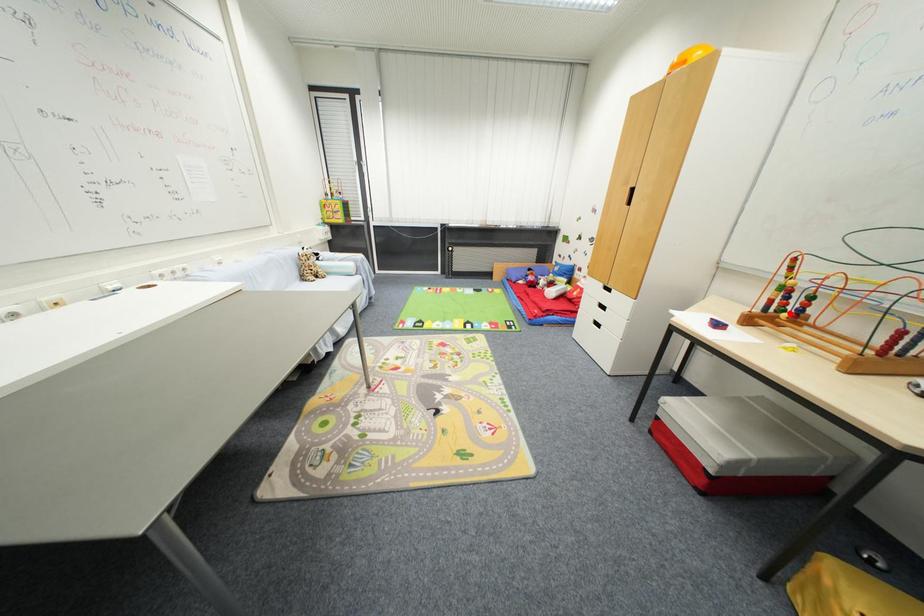
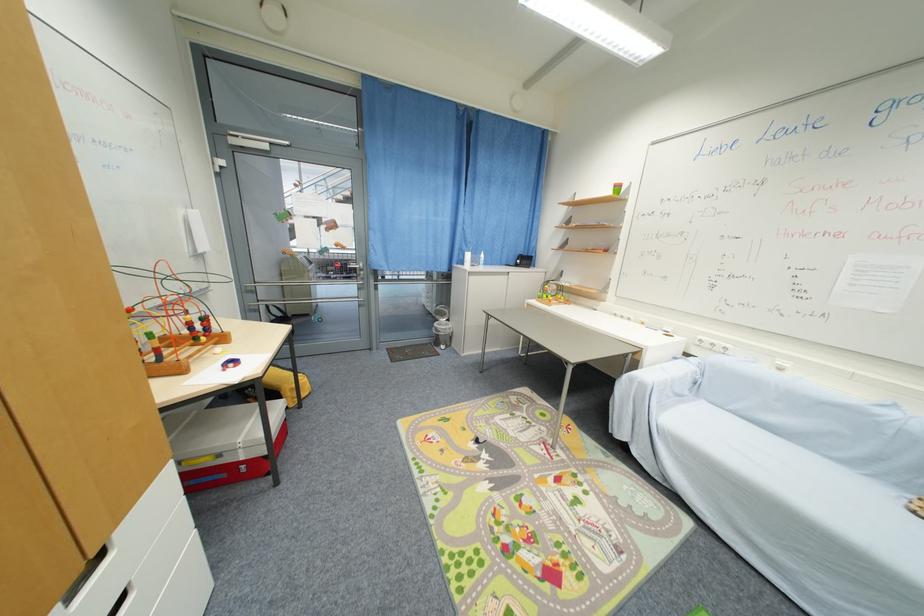
Question: I am providing you with two images of the same scene from different viewpoints. Given a red point in image1, look at the same physical point in image2. Is it:

Choices:
 (A) Closer to the viewpoint
 (B) Farther from the viewpoint

Answer: (A)